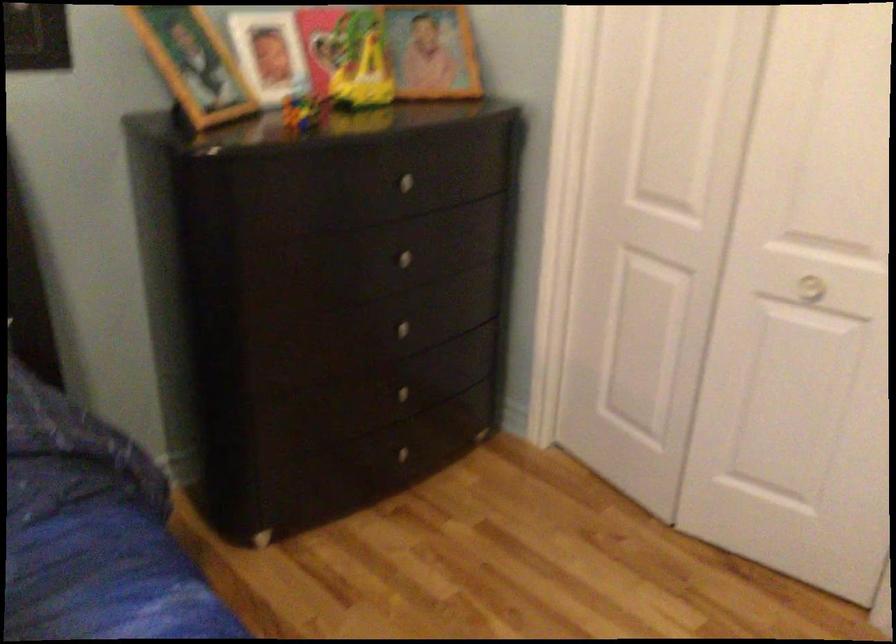
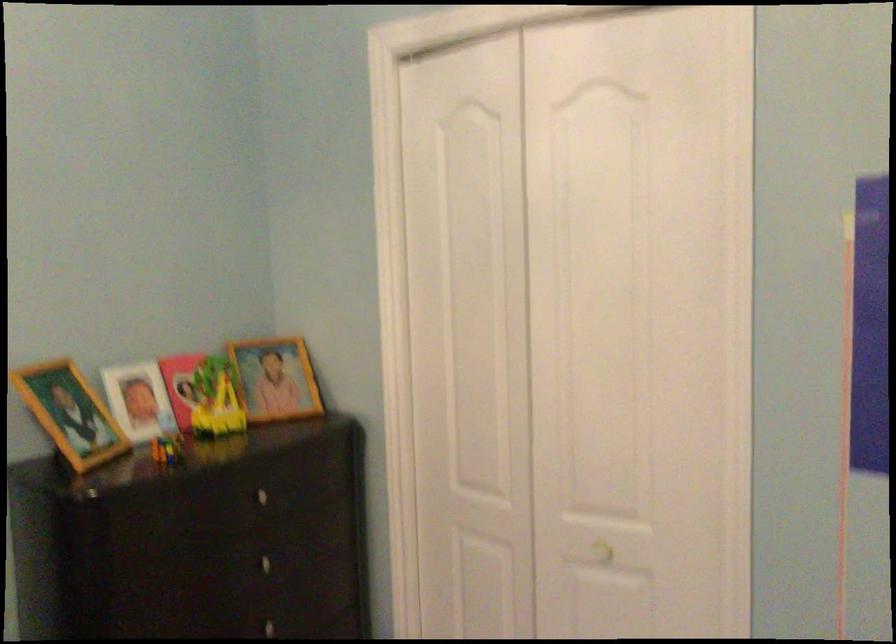
Question: How did the camera likely rotate?

Choices:
 (A) Left
 (B) Right
 (C) Up
 (D) Down

Answer: (C)